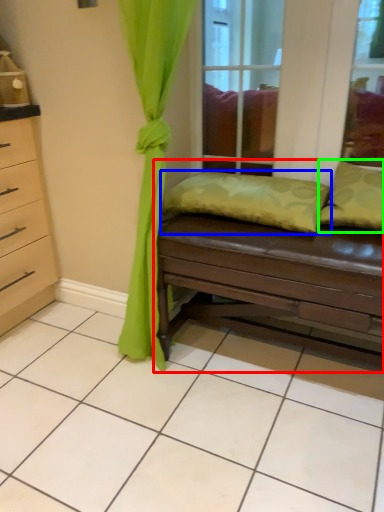
Question: Which object is the farthest from studio couch (highlighted by a red box)? Choose among these: pillow (highlighted by a blue box) or pillow (highlighted by a green box).

Choices:
 (A) pillow
 (B) pillow

Answer: (B)